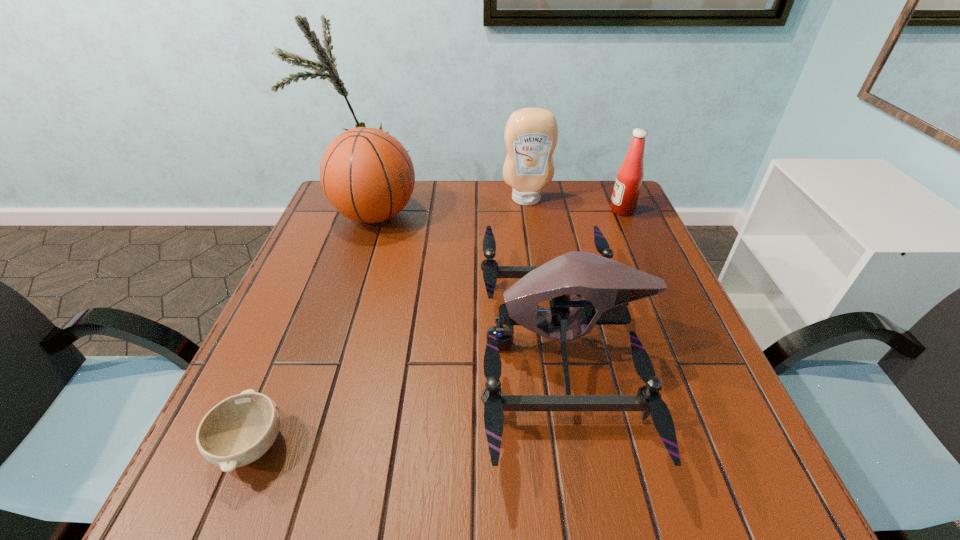
I want to click on drone at the right edge, so click(608, 286).

Identify the location of object that is at the far left corner. (368, 176).

In order to click on object present at the near left corner in this screenshot , I will do `click(237, 431)`.

Where is `object present at the far right corner`? object present at the far right corner is located at coordinates (629, 178).

The width and height of the screenshot is (960, 540). I want to click on object located at the near right corner, so click(x=608, y=286).

Where is `free region at the far edge`? free region at the far edge is located at coordinates (406, 214).

Find the location of a particular element. The width and height of the screenshot is (960, 540). vacant space at the near edge of the desktop is located at coordinates (476, 513).

In the image, there is a desktop. At what (x,y) coordinates should I click in order to perform the action: click on vacant space at the left edge. Please return your answer as a coordinate pair (x, y). Looking at the image, I should click on pyautogui.click(x=345, y=260).

Locate an element on the screen. blank area at the near right corner is located at coordinates (735, 460).

The height and width of the screenshot is (540, 960). I want to click on empty location between the basketball and the bowl, so click(314, 330).